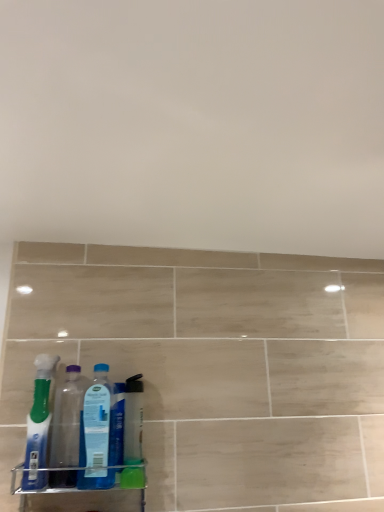
Question: Does transparent plastic bottle at left, the 2th bottle positioned from the left, touch translucent blue toothbrush at left, the 3th bottle from the right?

Choices:
 (A) no
 (B) yes

Answer: (B)

Question: Is transparent plastic bottle at left, the 2th bottle when ordered from right to left, looking in the opposite direction of translucent blue toothbrush at left, the 3th bottle from the right?

Choices:
 (A) yes
 (B) no

Answer: (B)

Question: From the image's perspective, is transparent plastic bottle at left, the 2th bottle when ordered from right to left, located above translucent blue toothbrush at left, marked as the 1th bottle in a left-to-right arrangement?

Choices:
 (A) yes
 (B) no

Answer: (B)

Question: Is transparent plastic bottle at left, the 2th bottle when ordered from right to left, at the left side of translucent blue toothbrush at left, marked as the 1th bottle in a left-to-right arrangement?

Choices:
 (A) yes
 (B) no

Answer: (B)

Question: Considering the relative sizes of transparent plastic bottle at left, the 2th bottle positioned from the left, and translucent blue toothbrush at left, the 3th bottle from the right, in the image provided, is transparent plastic bottle at left, the 2th bottle positioned from the left, bigger than translucent blue toothbrush at left, the 3th bottle from the right,?

Choices:
 (A) no
 (B) yes

Answer: (A)

Question: Is the position of transparent plastic bottle at left, the 2th bottle positioned from the left, more distant than that of translucent blue toothbrush at left, marked as the 1th bottle in a left-to-right arrangement?

Choices:
 (A) no
 (B) yes

Answer: (B)

Question: Would you say clear plastic spray bottle at center is a long distance from transparent plastic bottle at left, the 2th bottle positioned from the left?

Choices:
 (A) yes
 (B) no

Answer: (B)

Question: Is clear plastic spray bottle at center positioned with its back to transparent plastic bottle at left, the 2th bottle positioned from the left?

Choices:
 (A) no
 (B) yes

Answer: (A)

Question: Can you confirm if clear plastic spray bottle at center is wider than transparent plastic bottle at left, the 2th bottle positioned from the left?

Choices:
 (A) yes
 (B) no

Answer: (B)

Question: From the image's perspective, is clear plastic spray bottle at center beneath transparent plastic bottle at left, the 2th bottle positioned from the left?

Choices:
 (A) no
 (B) yes

Answer: (B)

Question: Is clear plastic spray bottle at center positioned before transparent plastic bottle at left, the 2th bottle when ordered from right to left?

Choices:
 (A) yes
 (B) no

Answer: (B)

Question: Is clear plastic spray bottle at center shorter than transparent plastic bottle at left, the 2th bottle when ordered from right to left?

Choices:
 (A) no
 (B) yes

Answer: (B)

Question: From a real-world perspective, is blue translucent bottle at center, the 3th bottle in the left-to-right sequence, located beneath clear plastic spray bottle at center?

Choices:
 (A) no
 (B) yes

Answer: (A)